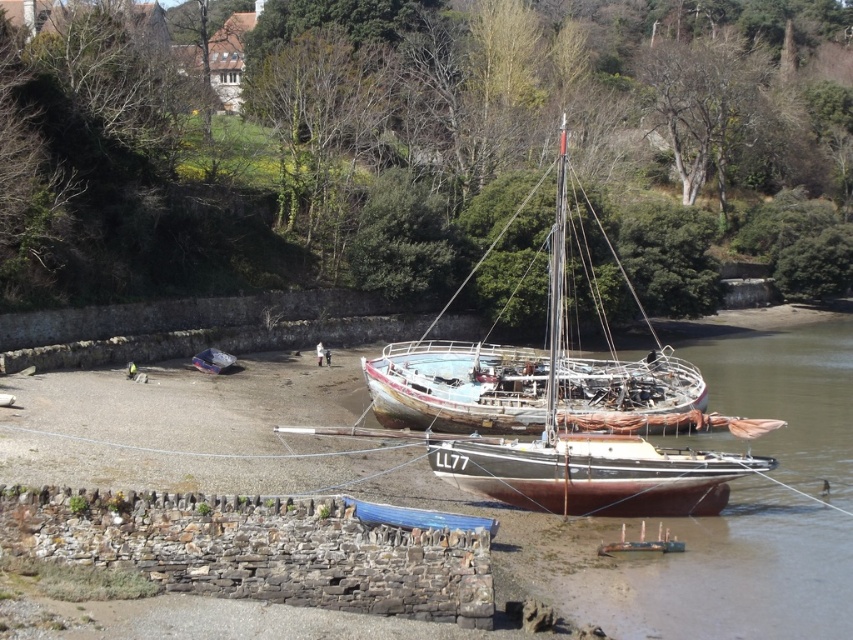
Question: Can you confirm if rusty metal sailboat at center is smaller than rusty wooden boat at center?

Choices:
 (A) yes
 (B) no

Answer: (B)

Question: Which point is closer to the camera?

Choices:
 (A) rusty metal sailboat at center
 (B) rusty wooden boat at center

Answer: (A)

Question: Can you confirm if rusty metal sailboat at center is positioned below rusty wooden boat at center?

Choices:
 (A) no
 (B) yes

Answer: (A)

Question: Which object appears farthest from the camera in this image?

Choices:
 (A) rusty wooden boat at center
 (B) rusty metal sailboat at center

Answer: (A)

Question: Which of the following is the farthest from the observer?

Choices:
 (A) (563, 246)
 (B) (402, 388)

Answer: (B)

Question: Does rusty metal sailboat at center appear on the left side of rusty wooden boat at center?

Choices:
 (A) yes
 (B) no

Answer: (B)